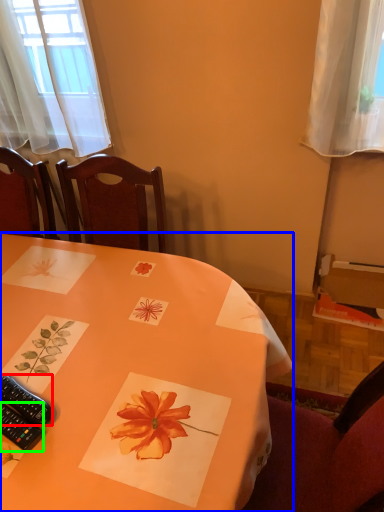
Question: Estimate the real-world distances between objects in this image. Which object is farther from remote control (highlighted by a red box), table (highlighted by a blue box) or remote control (highlighted by a green box)?

Choices:
 (A) table
 (B) remote control

Answer: (A)